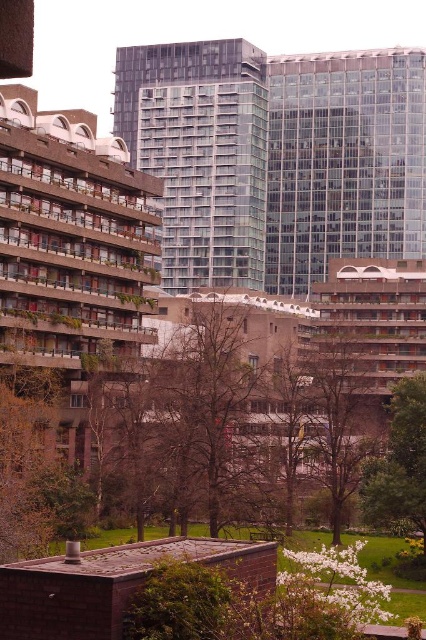
Question: Is glassy modern building at center wider than brown leafless tree at center?

Choices:
 (A) no
 (B) yes

Answer: (B)

Question: Which point is closer to the camera?

Choices:
 (A) (322, 394)
 (B) (422, 387)
 (C) (397, 67)

Answer: (B)

Question: Which point is closer to the camera?

Choices:
 (A) green leafy tree at lower right
 (B) glassy modern building at center
 (C) brown leafless tree at center

Answer: (A)

Question: Does glassy modern building at center have a smaller size compared to green leafy tree at lower right?

Choices:
 (A) yes
 (B) no

Answer: (B)

Question: Is glassy modern building at center smaller than brown leafless tree at center?

Choices:
 (A) no
 (B) yes

Answer: (A)

Question: Which point is closer to the camera?

Choices:
 (A) (324, 484)
 (B) (391, 449)

Answer: (B)